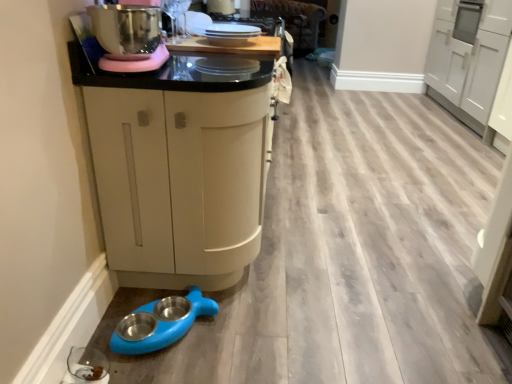
Identify the location of free space to the right of matte cream cabinet at center, acting as the 1th cabinetry starting from the front. Image resolution: width=512 pixels, height=384 pixels. (374, 273).